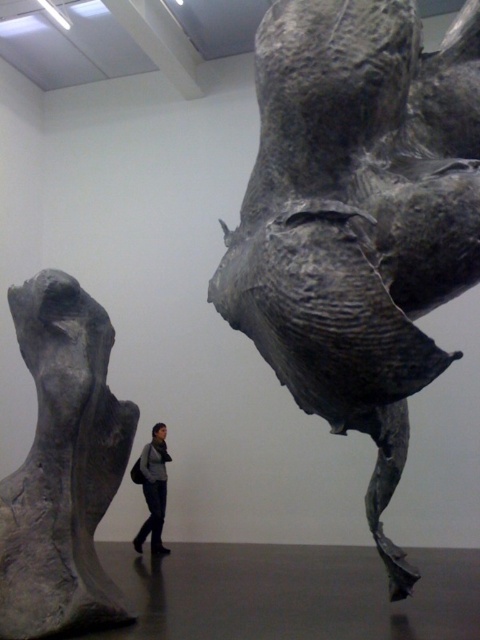
Who is more forward, (347,177) or (8,620)?

Point (347,177) is in front.

Is gray textured sculpture at upper right positioned at the back of gray matte sculpture at left?

No, it is in front of gray matte sculpture at left.

Is point (474, 99) farther from camera compared to point (17, 534)?

No, it is in front of (17, 534).

Where is `gray textured sculpture at upper right`? The height and width of the screenshot is (640, 480). gray textured sculpture at upper right is located at coordinates (358, 218).

Does gray matte sculpture at left have a lesser width compared to dark gray fabric jacket at center?

No.

Does gray matte sculpture at left have a larger size compared to dark gray fabric jacket at center?

Yes, gray matte sculpture at left is bigger than dark gray fabric jacket at center.

Locate an element on the screen. gray matte sculpture at left is located at coordinates (62, 467).

Locate an element on the screen. The image size is (480, 640). gray matte sculpture at left is located at coordinates (62, 467).

Is point (261, 108) farther from camera compared to point (163, 499)?

No, it is in front of (163, 499).

Can you confirm if gray textured sculpture at upper right is smaller than dark gray fabric jacket at center?

Incorrect, gray textured sculpture at upper right is not smaller in size than dark gray fabric jacket at center.

Is point (354, 90) positioned before point (159, 474)?

That is True.

This screenshot has width=480, height=640. In order to click on gray textured sculpture at upper right in this screenshot , I will do `click(358, 218)`.